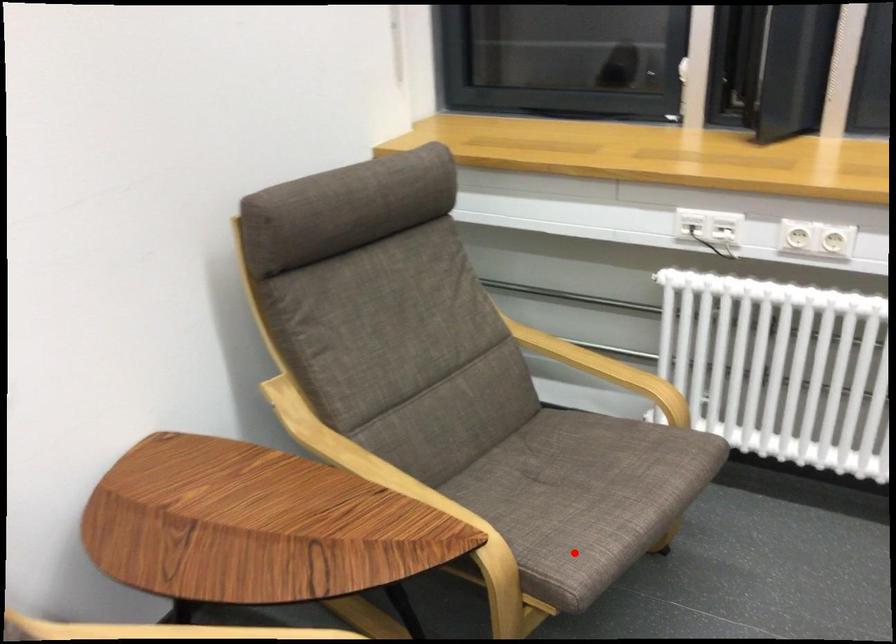
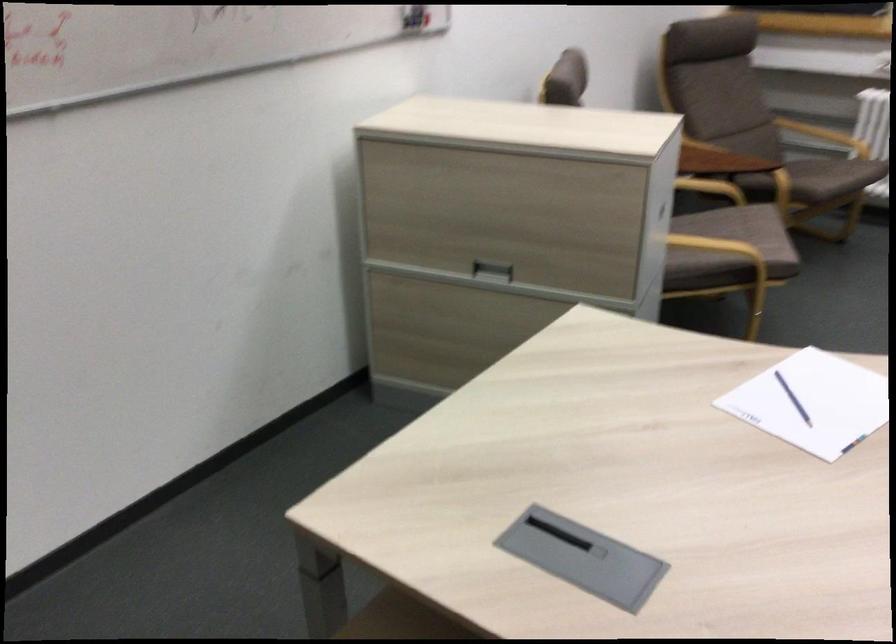
Question: I am providing you with two images of the same scene from different viewpoints. A red point is shown in image1. For the corresponding object point in image2, is it positioned nearer or farther from the camera?

Choices:
 (A) Nearer
 (B) Farther

Answer: (B)